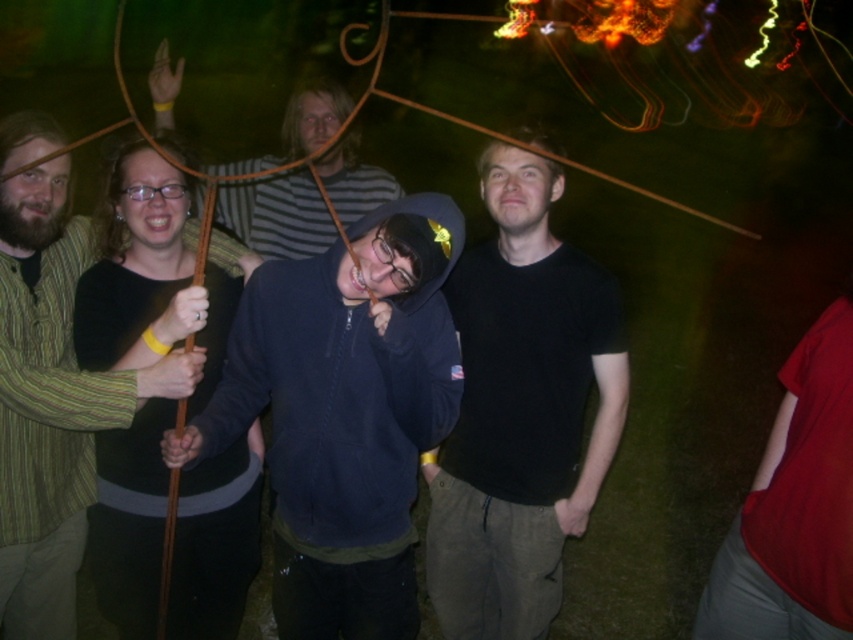
Question: Which point is farther from the camera taking this photo?

Choices:
 (A) pos(489,257)
 (B) pos(3,554)

Answer: (A)

Question: Is black matte t-shirt at center positioned before green striped shirt at left?

Choices:
 (A) no
 (B) yes

Answer: (A)

Question: Is black matte t-shirt at center thinner than green striped shirt at left?

Choices:
 (A) yes
 (B) no

Answer: (A)

Question: Is black matte t-shirt at center positioned before green striped shirt at left?

Choices:
 (A) yes
 (B) no

Answer: (B)